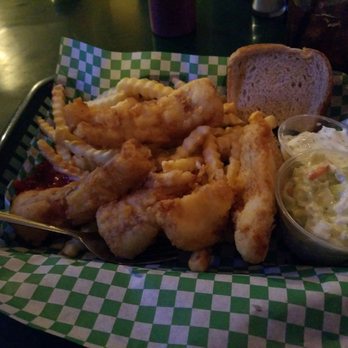
The height and width of the screenshot is (348, 348). In order to click on metal tray in this screenshot , I will do `click(21, 124)`.